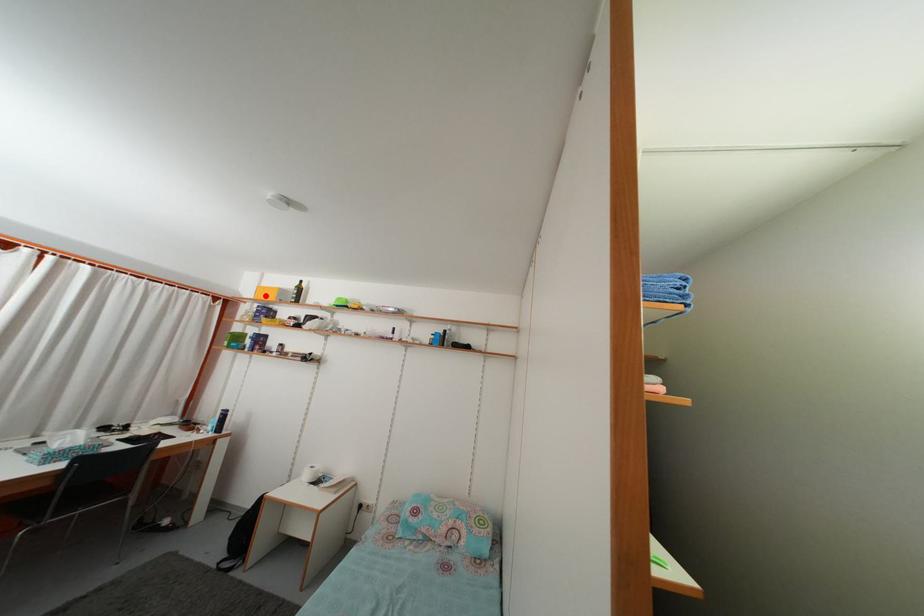
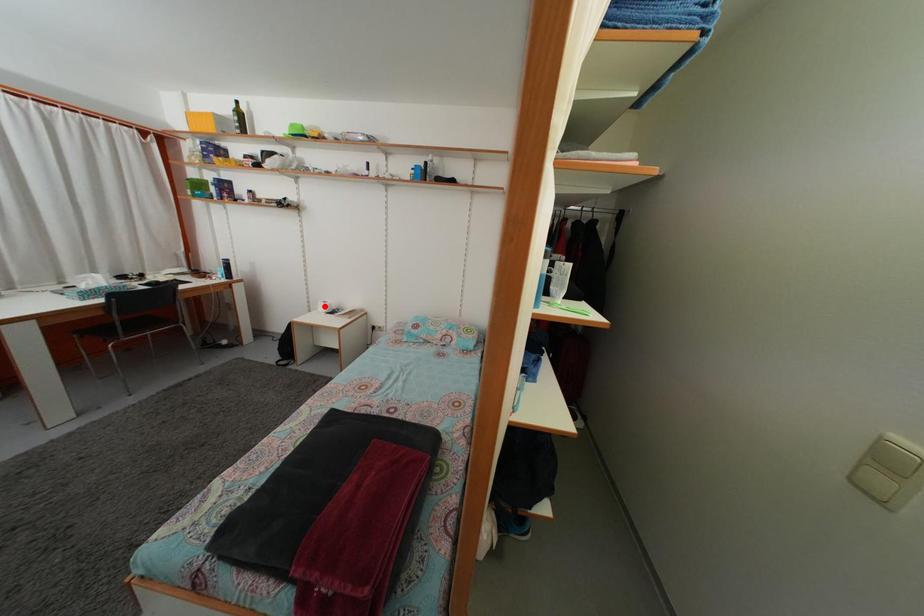
I am providing you with two images of the same scene from different viewpoints. A red point is marked on the first image and another point is marked on the second image. Do the highlighted points in image1 and image2 indicate the same real-world spot?

No